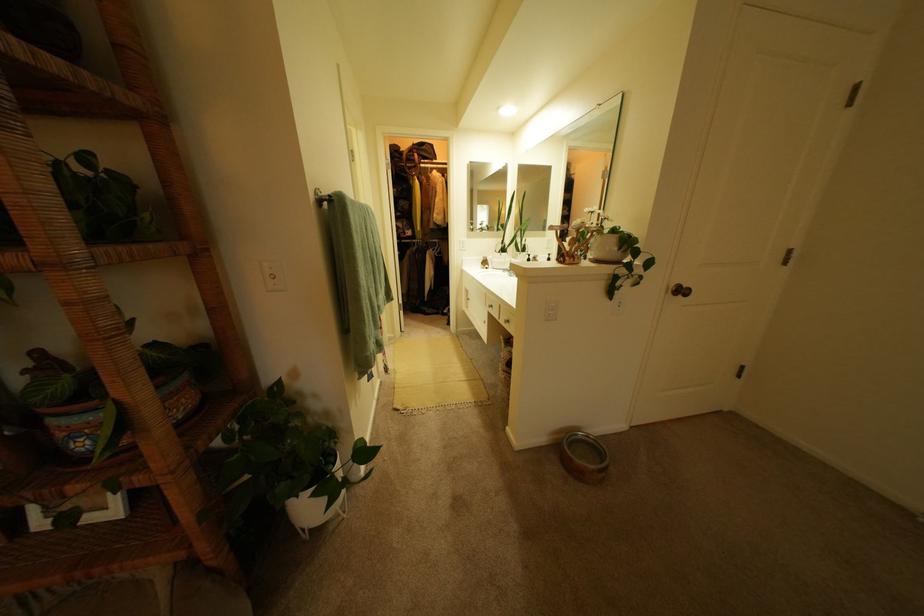
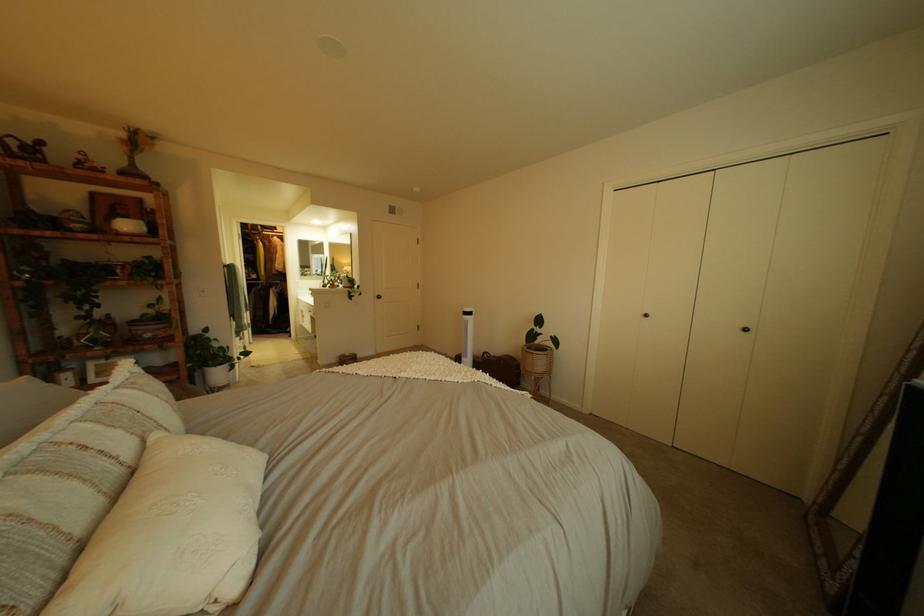
Find the pixel in the second image that matches [432,156] in the first image.

(274, 228)